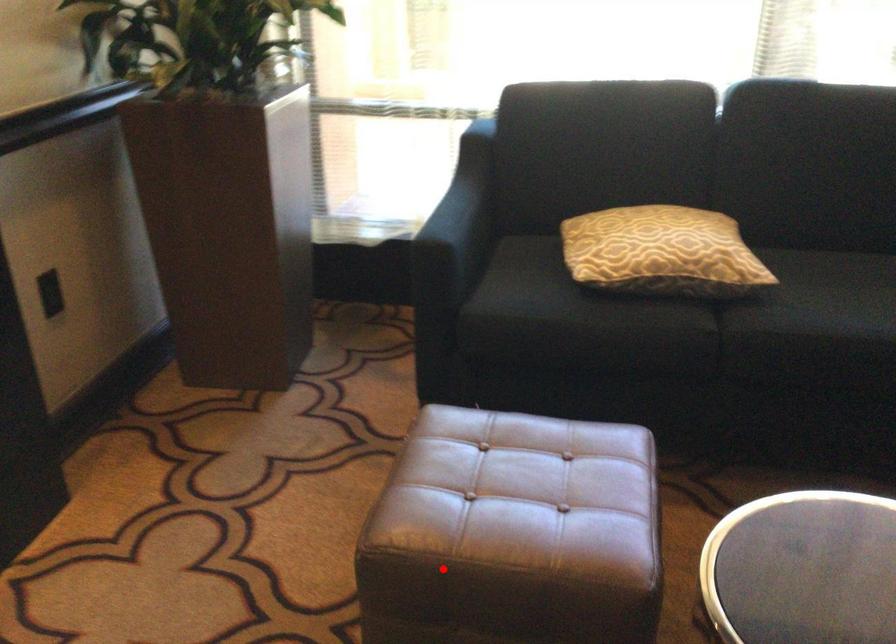
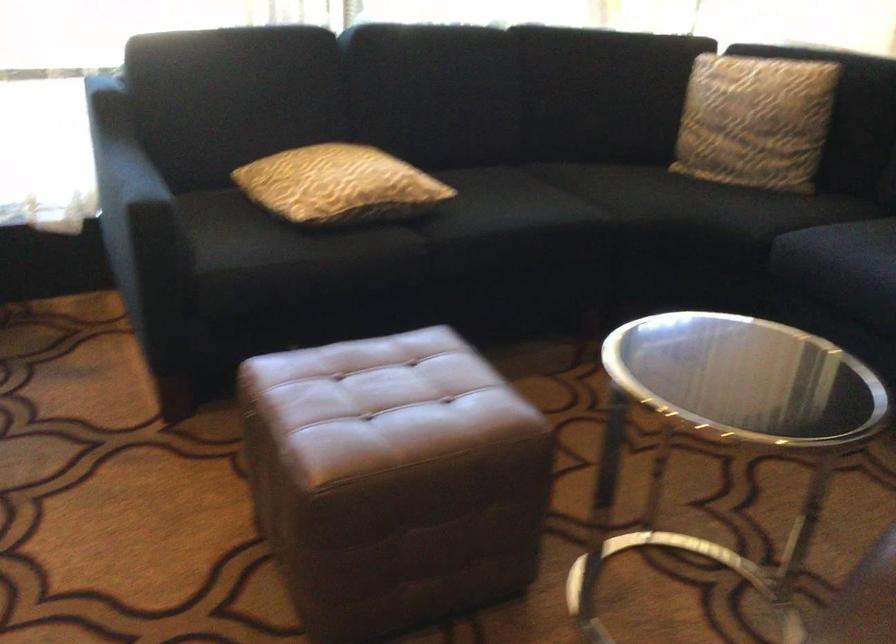
Find the pixel in the second image that matches the highlighted location in the first image.

(392, 480)